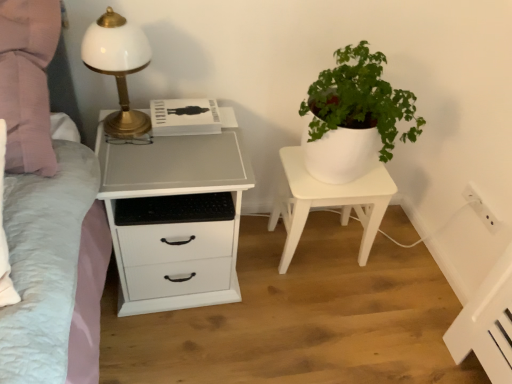
Question: Is white matte plant pot at center oriented away from white plastic electric outlet at upper right?

Choices:
 (A) no
 (B) yes

Answer: (A)

Question: Can you confirm if white matte plant pot at center is positioned to the left of white plastic electric outlet at upper right?

Choices:
 (A) yes
 (B) no

Answer: (A)

Question: From a real-world perspective, is white matte plant pot at center below white plastic electric outlet at upper right?

Choices:
 (A) no
 (B) yes

Answer: (B)

Question: Can you confirm if white matte plant pot at center is taller than white plastic electric outlet at upper right?

Choices:
 (A) no
 (B) yes

Answer: (B)

Question: Considering the relative sizes of white matte plant pot at center and white plastic electric outlet at upper right in the image provided, is white matte plant pot at center bigger than white plastic electric outlet at upper right?

Choices:
 (A) yes
 (B) no

Answer: (A)

Question: From the image's perspective, is white matte plant pot at center located above or below white matte chest of drawers at left?

Choices:
 (A) below
 (B) above

Answer: (B)

Question: Choose the correct answer: Is white matte plant pot at center inside white matte chest of drawers at left or outside it?

Choices:
 (A) inside
 (B) outside

Answer: (B)

Question: Is white matte plant pot at center taller or shorter than white matte chest of drawers at left?

Choices:
 (A) tall
 (B) short

Answer: (B)

Question: Relative to white matte chest of drawers at left, is white matte plant pot at center in front or behind?

Choices:
 (A) front
 (B) behind

Answer: (B)

Question: From their relative heights in the image, would you say white matte chest of drawers at left is taller or shorter than white plastic electric outlet at upper right?

Choices:
 (A) short
 (B) tall

Answer: (B)

Question: Is point (163, 235) closer or farther from the camera than point (482, 203)?

Choices:
 (A) farther
 (B) closer

Answer: (B)

Question: Based on their sizes in the image, would you say white matte chest of drawers at left is bigger or smaller than white plastic electric outlet at upper right?

Choices:
 (A) small
 (B) big

Answer: (B)

Question: Visually, is white matte chest of drawers at left positioned to the left or to the right of white plastic electric outlet at upper right?

Choices:
 (A) left
 (B) right

Answer: (A)

Question: From a real-world perspective, is white matte chest of drawers at left above or below white glossy table lamp at left?

Choices:
 (A) below
 (B) above

Answer: (A)

Question: Is white matte chest of drawers at left in front of or behind white glossy table lamp at left in the image?

Choices:
 (A) front
 (B) behind

Answer: (B)